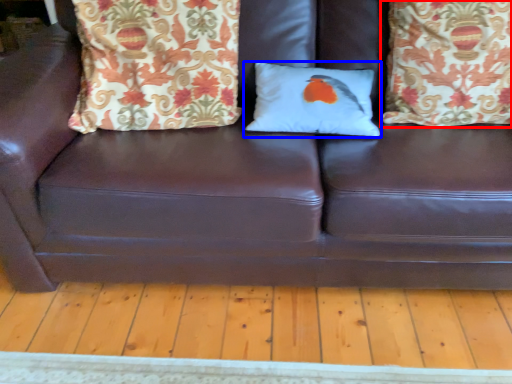
Question: Which object is closer to the camera taking this photo, pillow (highlighted by a red box) or pillow (highlighted by a blue box)?

Choices:
 (A) pillow
 (B) pillow

Answer: (A)